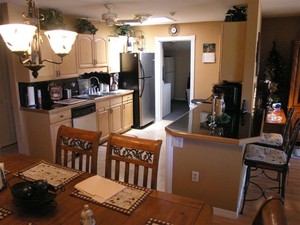
What are the coordinates of `doorway` in the screenshot? It's located at (191, 36).